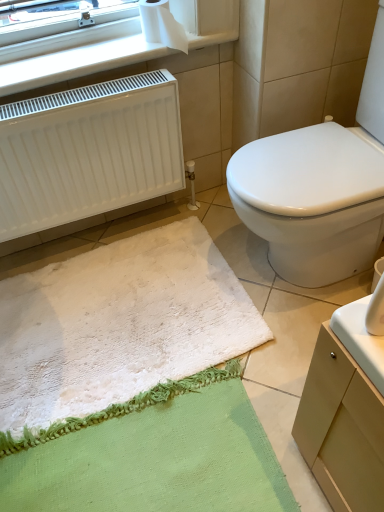
The width and height of the screenshot is (384, 512). Identify the location of free space above white matte radiator at left (from a real-world perspective). (85, 92).